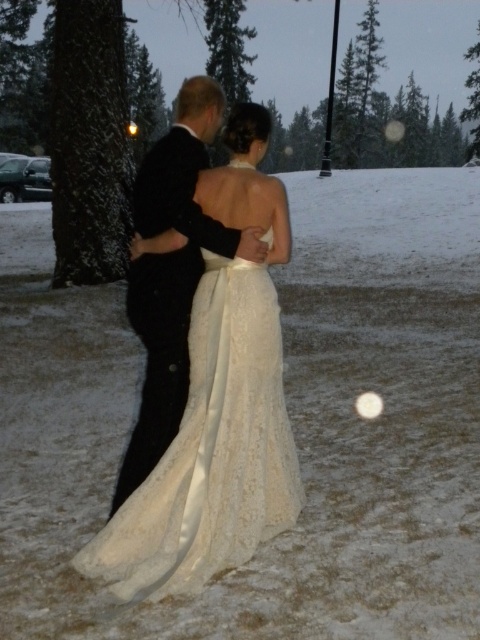
Does lace satin dress at center come behind black satin suit at center?

No, lace satin dress at center is in front of black satin suit at center.

How far apart are lace satin dress at center and black satin suit at center?

A distance of 28.39 inches exists between lace satin dress at center and black satin suit at center.

This screenshot has width=480, height=640. Find the location of `lace satin dress at center`. lace satin dress at center is located at coordinates (212, 451).